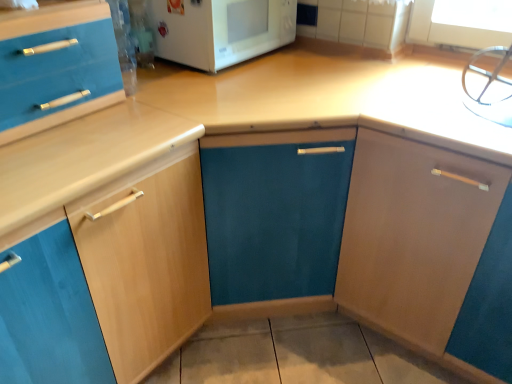
Question: Is white glossy microwave at upper center shorter than light wood cabinet at left, arranged as the 2th cabinetry when viewed from the right?

Choices:
 (A) no
 (B) yes

Answer: (B)

Question: From a real-world perspective, is white glossy microwave at upper center on top of light wood cabinet at left, arranged as the 2th cabinetry when viewed from the right?

Choices:
 (A) no
 (B) yes

Answer: (B)

Question: Is light wood cabinet at left, arranged as the 2th cabinetry when viewed from the right, completely or partially inside white glossy microwave at upper center?

Choices:
 (A) no
 (B) yes

Answer: (A)

Question: From the image's perspective, is white glossy microwave at upper center located above light wood cabinet at left, the 1th cabinetry positioned from the left?

Choices:
 (A) no
 (B) yes

Answer: (B)

Question: Does white glossy microwave at upper center have a smaller size compared to light wood cabinet at left, arranged as the 2th cabinetry when viewed from the right?

Choices:
 (A) yes
 (B) no

Answer: (A)

Question: Is matte wood cabinet at right, which appears as the first cabinetry when viewed from the right, bigger or smaller than white glossy microwave at upper center?

Choices:
 (A) big
 (B) small

Answer: (A)

Question: From the image's perspective, relative to white glossy microwave at upper center, is matte wood cabinet at right, the second cabinetry viewed from the left, above or below?

Choices:
 (A) above
 (B) below

Answer: (B)

Question: From their relative heights in the image, would you say matte wood cabinet at right, the second cabinetry viewed from the left, is taller or shorter than white glossy microwave at upper center?

Choices:
 (A) tall
 (B) short

Answer: (A)

Question: Is matte wood cabinet at right, which appears as the first cabinetry when viewed from the right, inside or outside of white glossy microwave at upper center?

Choices:
 (A) outside
 (B) inside

Answer: (A)

Question: In the image, is light wood cabinet at left, arranged as the 2th cabinetry when viewed from the right, positioned in front of or behind matte wood cabinet at right, which appears as the first cabinetry when viewed from the right?

Choices:
 (A) front
 (B) behind

Answer: (A)

Question: Based on their positions, is light wood cabinet at left, arranged as the 2th cabinetry when viewed from the right, located to the left or right of matte wood cabinet at right, the second cabinetry viewed from the left?

Choices:
 (A) left
 (B) right

Answer: (A)

Question: From a real-world perspective, is light wood cabinet at left, the 1th cabinetry positioned from the left, physically located above or below matte wood cabinet at right, the second cabinetry viewed from the left?

Choices:
 (A) below
 (B) above

Answer: (A)

Question: Based on their sizes in the image, would you say light wood cabinet at left, the 1th cabinetry positioned from the left, is bigger or smaller than matte wood cabinet at right, which appears as the first cabinetry when viewed from the right?

Choices:
 (A) small
 (B) big

Answer: (A)

Question: Is white glossy microwave at upper center bigger or smaller than light wood cabinet at left, the 1th cabinetry positioned from the left?

Choices:
 (A) small
 (B) big

Answer: (A)

Question: Relative to light wood cabinet at left, arranged as the 2th cabinetry when viewed from the right, is white glossy microwave at upper center in front or behind?

Choices:
 (A) front
 (B) behind

Answer: (B)